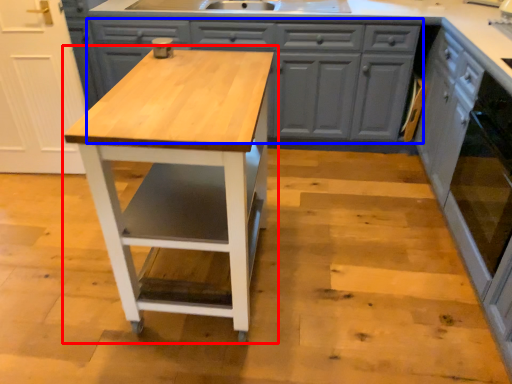
Question: Which of the following is the farthest to the observer, table (highlighted by a red box) or cabinetry (highlighted by a blue box)?

Choices:
 (A) table
 (B) cabinetry

Answer: (B)